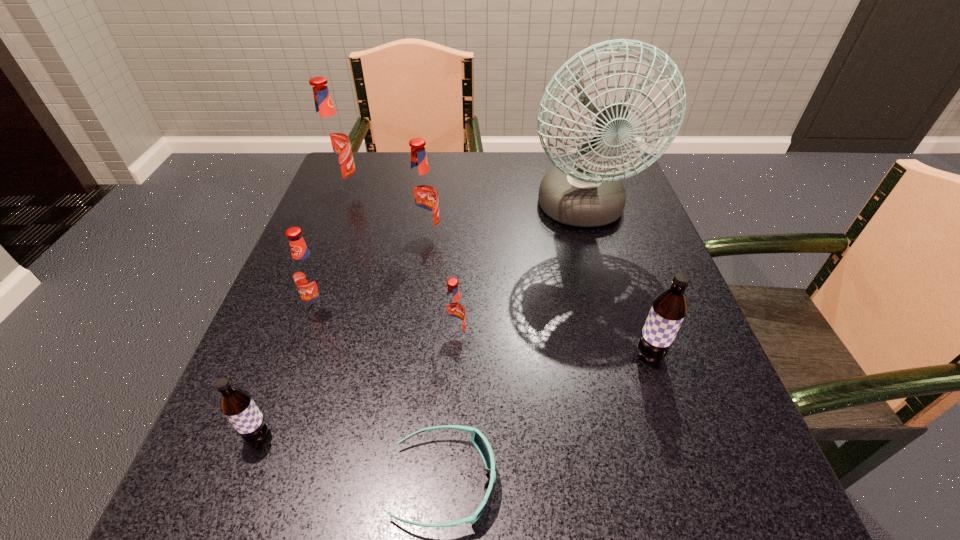
Where is `fan`? This screenshot has height=540, width=960. fan is located at coordinates (593, 115).

Where is `the farthest root beer`? This screenshot has width=960, height=540. the farthest root beer is located at coordinates (332, 141).

Image resolution: width=960 pixels, height=540 pixels. I want to click on the seventh shortest object, so click(332, 141).

Locate an element on the screen. The image size is (960, 540). the second tallest root beer is located at coordinates (422, 194).

Image resolution: width=960 pixels, height=540 pixels. I want to click on the third red root beer from left to right, so click(422, 194).

The height and width of the screenshot is (540, 960). In order to click on the fifth nearest object in this screenshot , I will do `click(308, 274)`.

At what (x,y) coordinates should I click in order to perform the action: click on the second smallest red root beer. Please return your answer as a coordinate pair (x, y). Looking at the image, I should click on (308, 274).

The image size is (960, 540). Find the location of `the farther brown root beer`. the farther brown root beer is located at coordinates (669, 308).

I want to click on the right brown root beer, so click(x=669, y=308).

Find the location of `the smallest red root beer`. the smallest red root beer is located at coordinates (454, 314).